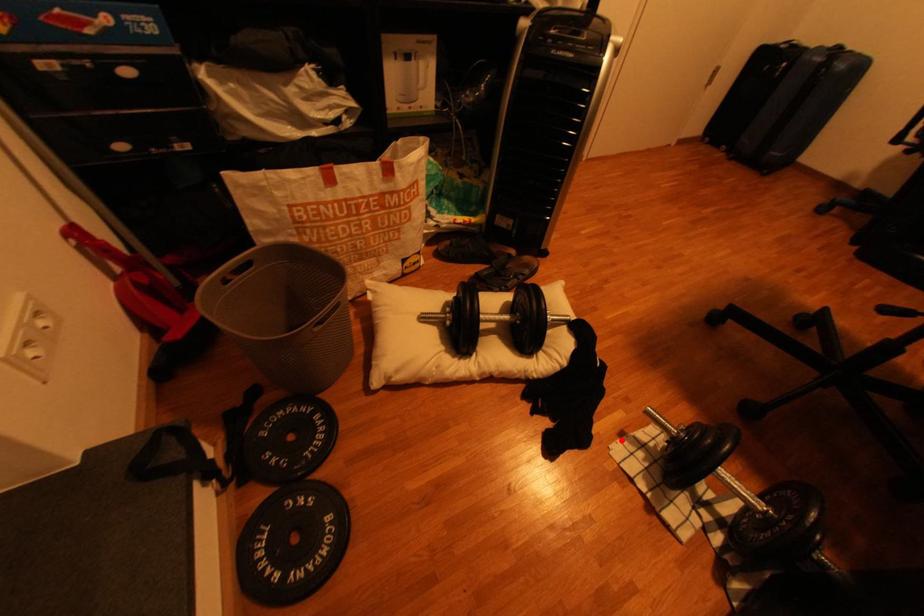
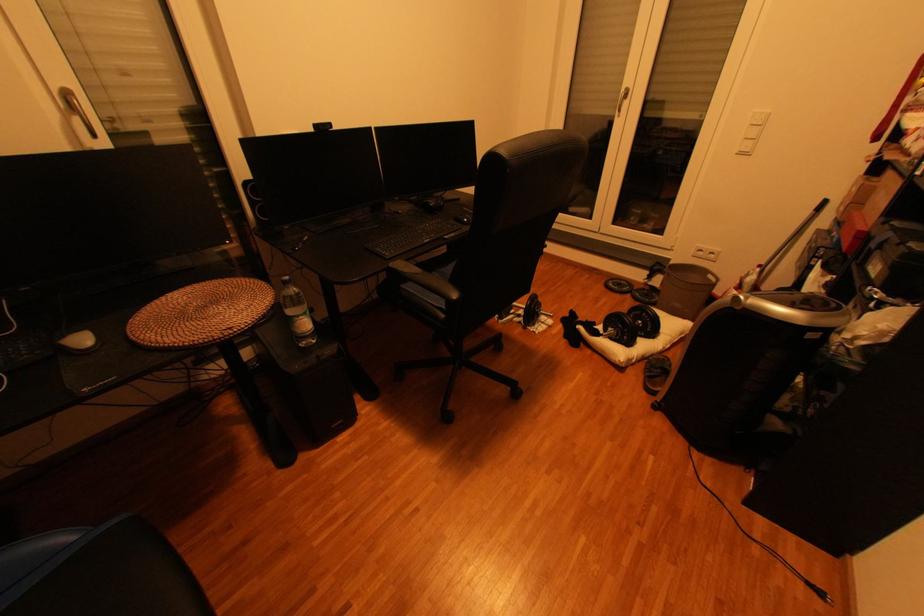
Locate, in the second image, the point that corresponds to the highlighted location in the first image.

(564, 323)